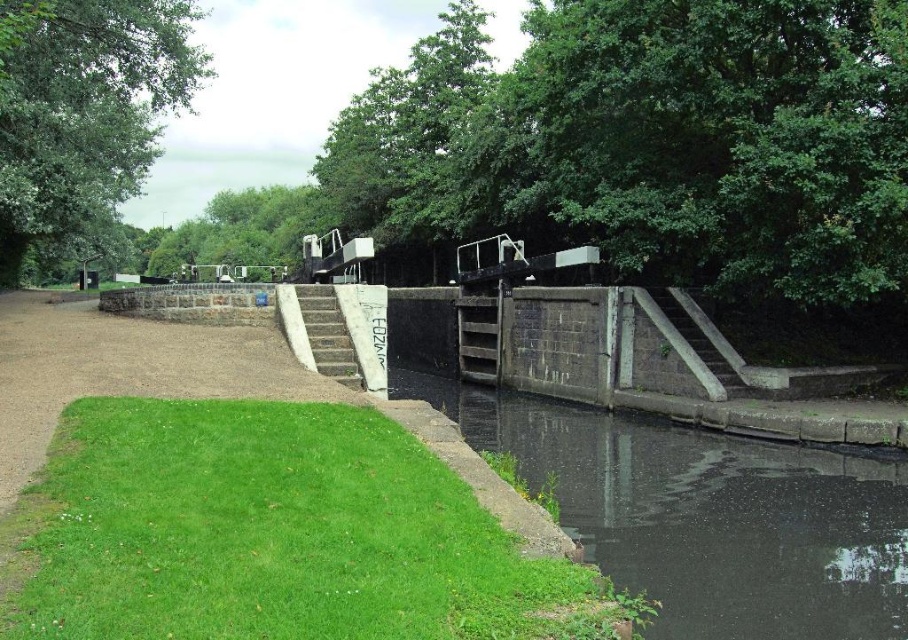
Based on the photo, does green leafy tree at upper left appear on the left side of concrete stairs at center?

Correct, you'll find green leafy tree at upper left to the left of concrete stairs at center.

Measure the distance between point (21,234) and camera.

25.51 meters

Where is `green leafy tree at upper left`? The width and height of the screenshot is (908, 640). green leafy tree at upper left is located at coordinates (84, 112).

Is point (785, 536) behind point (68, 83)?

No.

Does dark concrete water at center appear under green leafy tree at upper left?

Yes.

Locate an element on the screen. The height and width of the screenshot is (640, 908). dark concrete water at center is located at coordinates (706, 515).

Find the location of a particular element. dark concrete water at center is located at coordinates (706, 515).

Is point (817, 536) behind point (331, 321)?

No, (817, 536) is in front of (331, 321).

Which of these two, dark concrete water at center or concrete stairs at center, stands shorter?

Standing shorter between the two is dark concrete water at center.

Who is more forward, (796, 449) or (340, 355)?

Point (340, 355) is more forward.

This screenshot has width=908, height=640. I want to click on dark concrete water at center, so click(x=706, y=515).